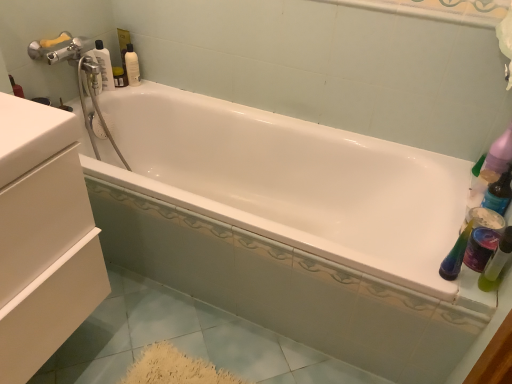
The width and height of the screenshot is (512, 384). I want to click on vacant area that is in front of white glossy mouthwash at upper left, placed as the 1th mouthwash when sorted from top to bottom, so click(x=122, y=91).